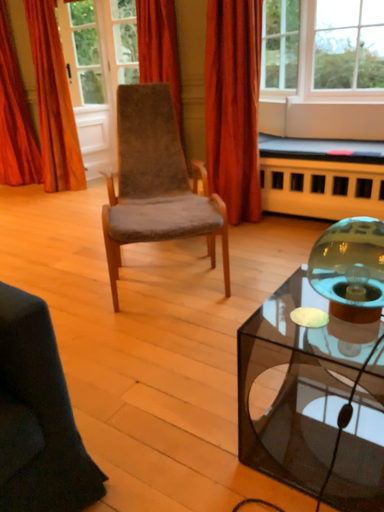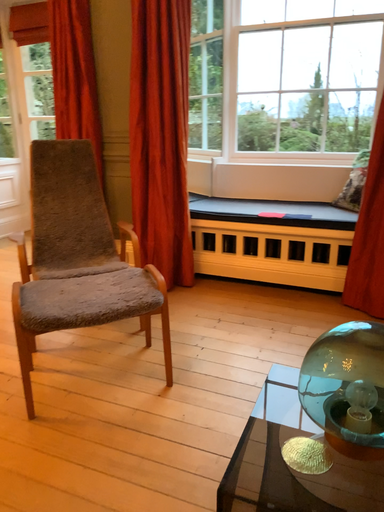
Question: How did the camera likely rotate when shooting the video?

Choices:
 (A) rotated right
 (B) rotated left

Answer: (A)